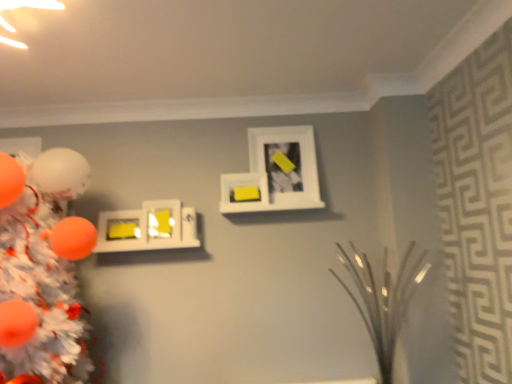
This screenshot has height=384, width=512. Identify the location of free space above white matte picture frame at upper center, which is counted as the 1th picture frame, starting from the right (from a real-world perspective). (278, 125).